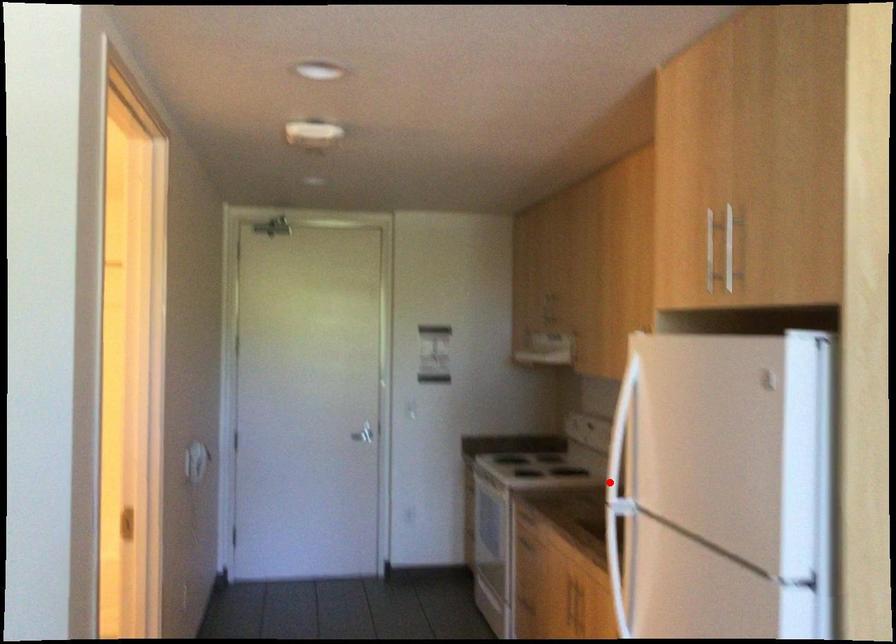
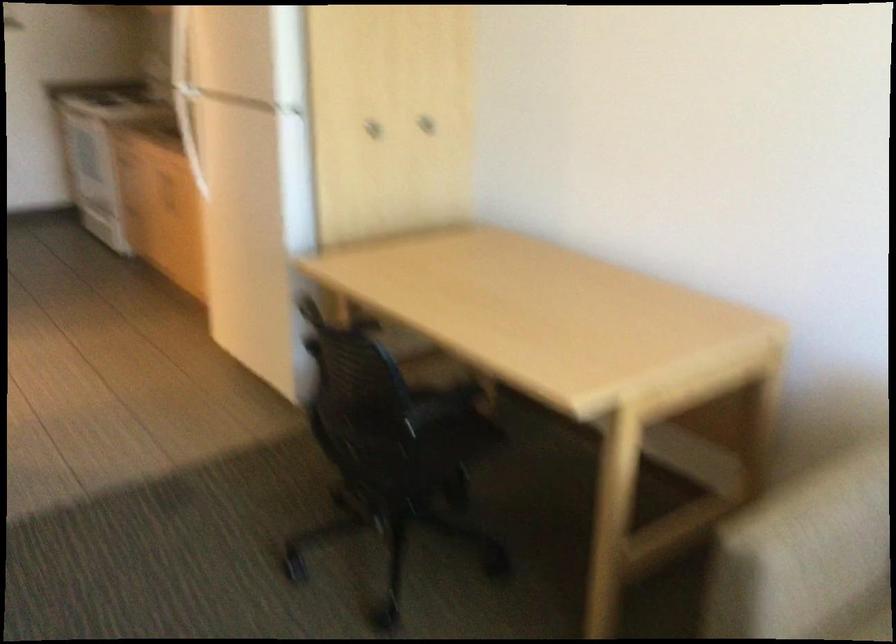
Question: I am providing you with two images of the same scene from different viewpoints. A red point is shown in image1. For the corresponding object point in image2, is it positioned nearer or farther from the camera?

Choices:
 (A) Nearer
 (B) Farther

Answer: (B)